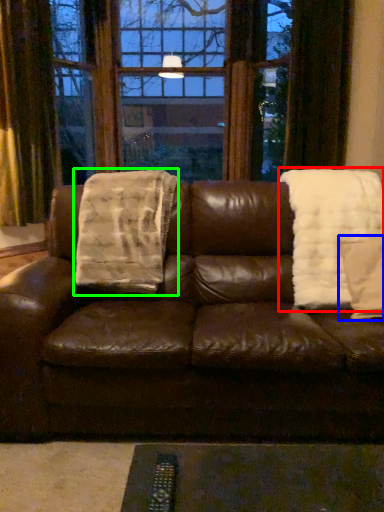
Question: Considering the real-world distances, which object is closest to blanket (highlighted by a red box)? throw pillow (highlighted by a blue box) or blanket (highlighted by a green box).

Choices:
 (A) throw pillow
 (B) blanket

Answer: (A)